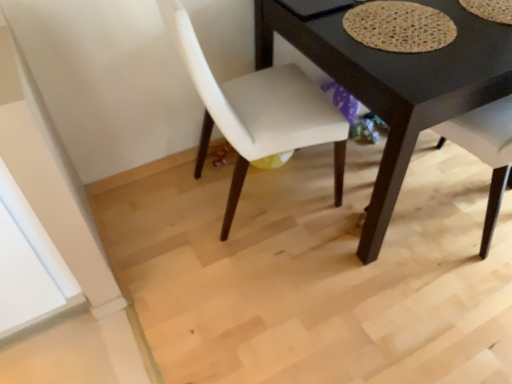
Question: In terms of size, does white fabric chair at center appear bigger or smaller than textured beige mat at upper right?

Choices:
 (A) big
 (B) small

Answer: (A)

Question: Does point (240, 135) appear closer or farther from the camera than point (390, 49)?

Choices:
 (A) closer
 (B) farther

Answer: (B)

Question: Considering the real-world distances, which object is farthest from the black matte table at center?

Choices:
 (A) white fabric chair at center
 (B) textured beige mat at upper right

Answer: (A)

Question: Estimate the real-world distances between objects in this image. Which object is farther from the textured beige mat at upper right?

Choices:
 (A) black matte table at center
 (B) white fabric chair at center

Answer: (B)